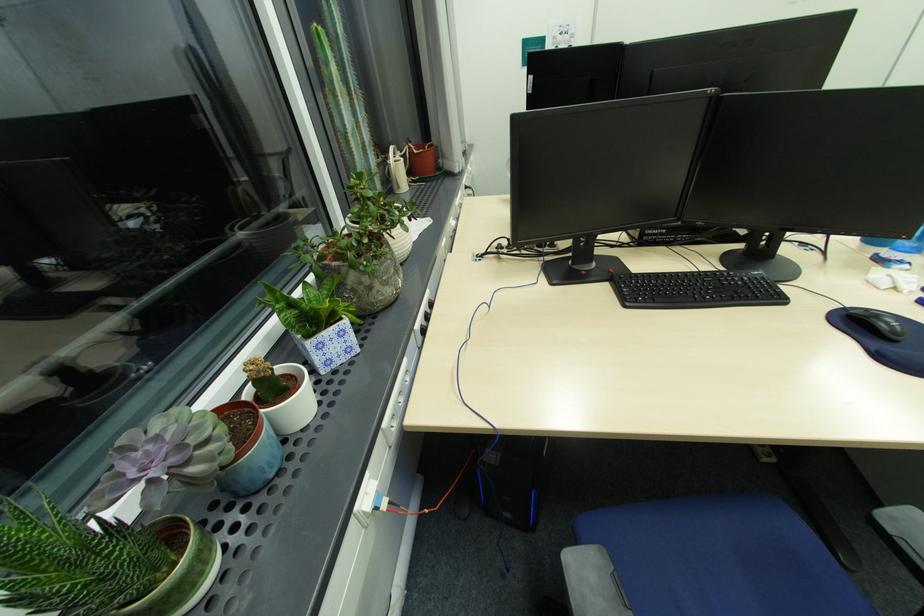
Find where to rest the grey chair armrest. Please return your answer as a coordinate pair (x, y).

(591, 582)